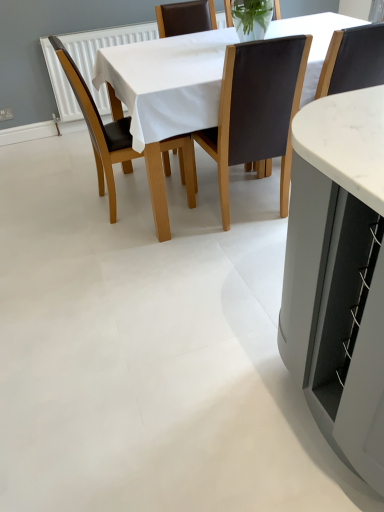
Locate an element on the screen. vacant space situated on the left part of brown leather chair at center, acting as the second chair starting from the right is located at coordinates (191, 227).